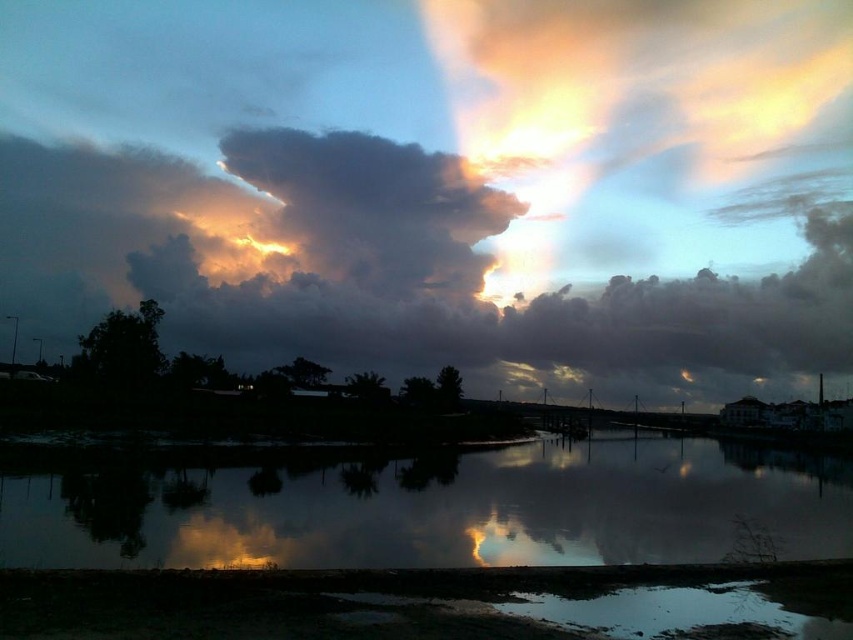
Question: Among these points, which one is farthest from the camera?

Choices:
 (A) (57, 561)
 (B) (392, 252)

Answer: (B)

Question: In this image, where is smooth reflective water at center located relative to dark gray fluffy cloud at upper center?

Choices:
 (A) left
 (B) right

Answer: (B)

Question: Can you confirm if smooth reflective water at center is wider than dark gray fluffy cloud at upper center?

Choices:
 (A) yes
 (B) no

Answer: (A)

Question: Is smooth reflective water at center thinner than dark gray fluffy cloud at upper center?

Choices:
 (A) yes
 (B) no

Answer: (B)

Question: Among these points, which one is farthest from the camera?

Choices:
 (A) (136, 476)
 (B) (306, 184)

Answer: (B)

Question: Which point is farther from the camera taking this photo?

Choices:
 (A) (381, 531)
 (B) (363, 172)

Answer: (B)